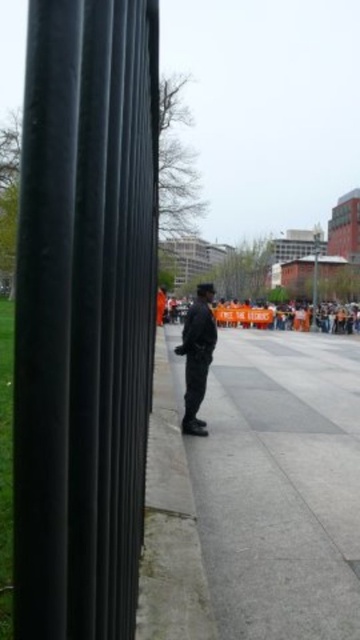
Question: Which of the following is the closest to the observer?

Choices:
 (A) (200, 333)
 (B) (222, 576)

Answer: (B)

Question: Does gray concrete curb at center appear over dark gray uniform at center?

Choices:
 (A) yes
 (B) no

Answer: (B)

Question: Can you confirm if gray concrete sidewalk at center is positioned to the right of gray concrete curb at center?

Choices:
 (A) no
 (B) yes

Answer: (B)

Question: Among these points, which one is nearest to the camera?

Choices:
 (A) (249, 339)
 (B) (186, 392)
 (C) (105, 8)

Answer: (C)

Question: Which object is the closest to the gray concrete curb at center?

Choices:
 (A) dark gray uniform at center
 (B) gray concrete sidewalk at center

Answer: (B)

Question: Can you confirm if black matte pole at left is smaller than dark gray uniform at center?

Choices:
 (A) yes
 (B) no

Answer: (B)